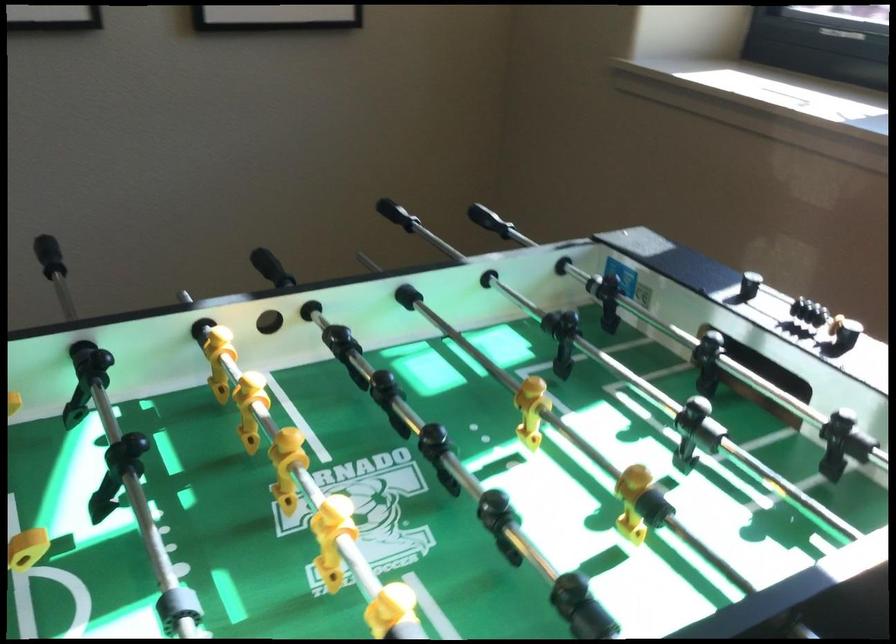
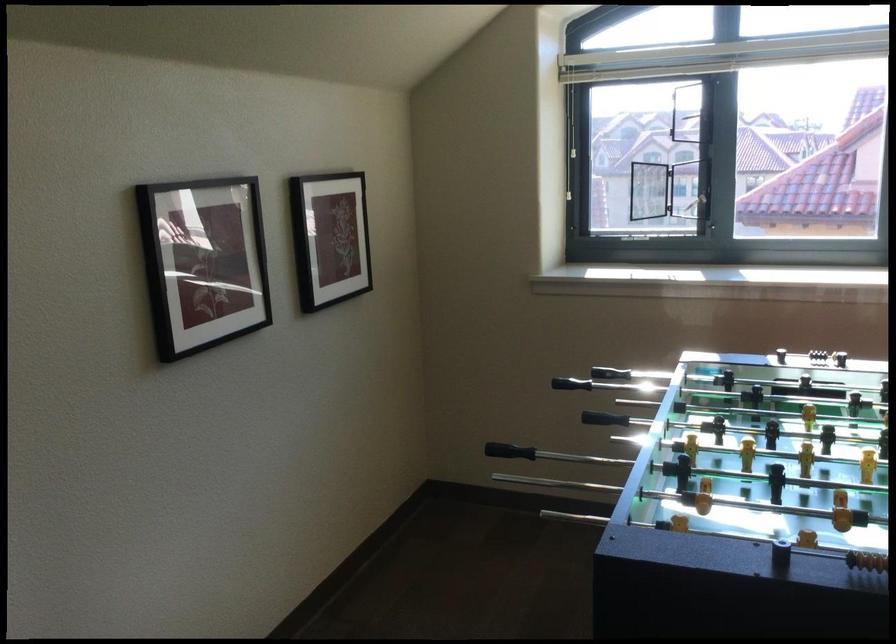
Find the pixel in the second image that matches [271,268] in the first image.

(604, 412)